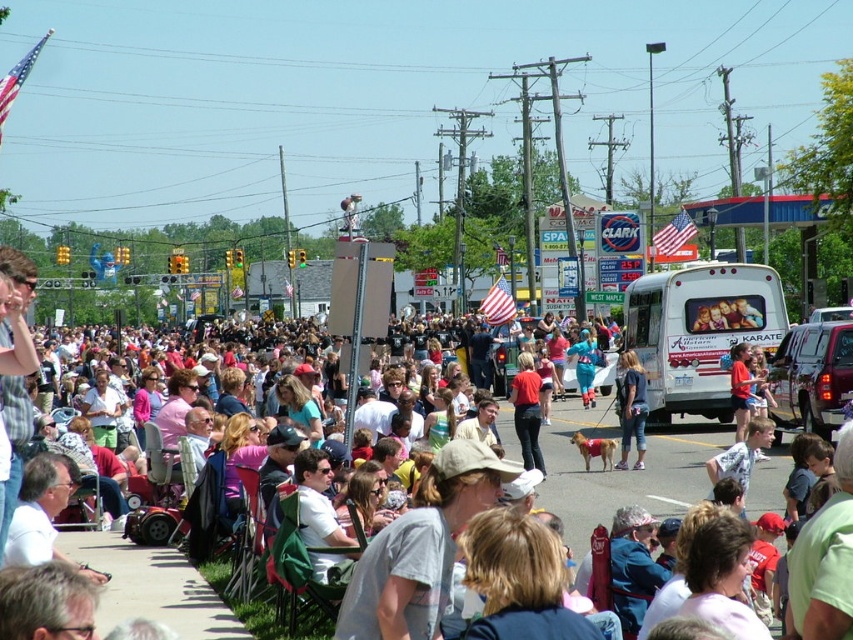
You are a photographer trying to capture both the white matte van at center and the light brown dog at center in a single shot. Given their sizes, which object should you focus on first to ensure both are in frame?

The white matte van at center is smaller than the light brown dog at center, so you should focus on the light brown dog at center first to ensure both fit in the frame.

You are a photographer at the event and want to capture both the red fabric dog at center and the matte red shirt at center in a single photo. Which object should you focus on first to ensure both are in frame?

You should focus on the red fabric dog at center first since it is taller than the matte red shirt at center, ensuring it fits within the frame while also capturing the smaller matte red shirt at center.

You are a photographer standing at the edge of the crowd, wanting to capture a photo that includes both the light brown dog at center and the matte red shirt at center. Given that your camera has a maximum focus range of 2 meters, will you be able to fit both subjects into the same frame without moving closer?

The distance between the light brown dog at center and the matte red shirt at center is 1.93 meters, which is within the camera maximum focus range of 2 meters. Therefore, you can capture both subjects in the same frame without moving closer.